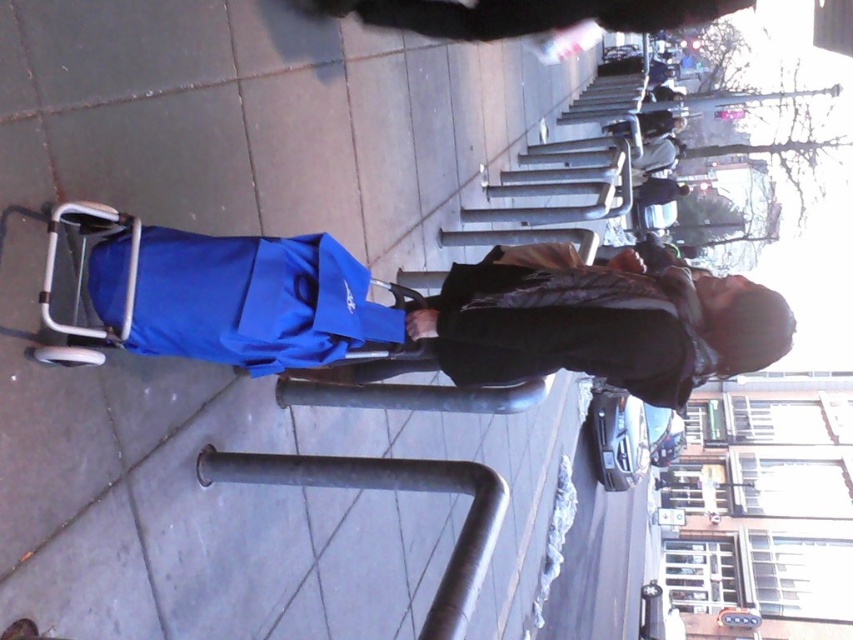
You are a delivery person trying to navigate through a narrow alley. You have a cart with a blue fabric bag at center and you are wearing a blue fabric jacket at center. The alley is only 1.8 meters wide. Can your cart pass through the alley without hitting the sides?

The blue fabric bag at center is taller than the blue fabric jacket at center, but the question is about width. Since the alley is 1.8 meters wide and the cart with the blue fabric bag at center and blue fabric jacket at center does not mention width in the description, it is impossible to determine if it can pass through without hitting the sides.

You are a delivery person trying to navigate a narrow sidewalk. You have a cart with a blue fabric bag at center and need to pass under a dark gray metal rail at center. Can your cart fit through the space between them?

The blue fabric bag at center and dark gray metal rail at center are 59.34 centimeters apart. If your cart is narrower than 59.34 centimeters, it can fit through the space between them.

You are a delivery person trying to navigate through the urban street scene. You need to move the small cart with the blue fabric bag at center around the metal bollards on the sidewalk. Based on the cart and bollards positions, can you safely maneuver the cart between the bollards without hitting them?

The blue fabric bag at center is located at point (x=456, y=314), so yes, the cart can be maneuvered safely between the bollards as long as the path is clear and the cart is steered carefully around the bollards positioned along the sidewalk edge.